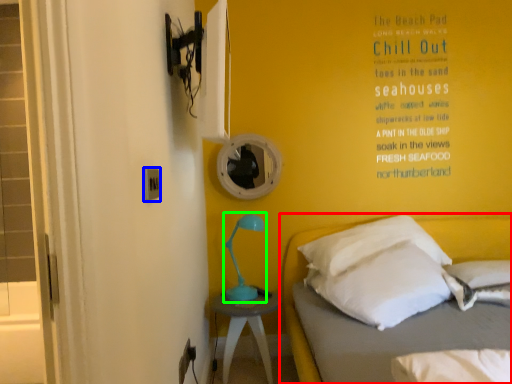
Question: Considering the real-world distances, which object is closest to bed (highlighted by a red box)? electric outlet (highlighted by a blue box) or table lamp (highlighted by a green box).

Choices:
 (A) electric outlet
 (B) table lamp

Answer: (B)